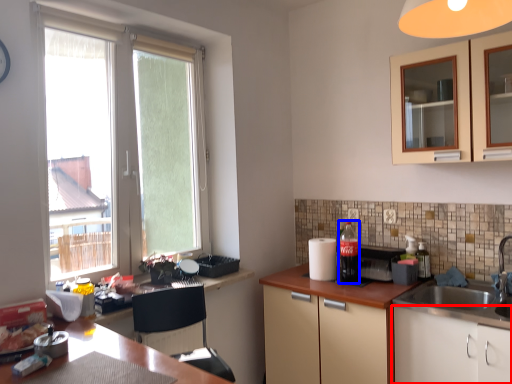
Question: Which point is further to the camera, cabinetry (highlighted by a red box) or beverage (highlighted by a blue box)?

Choices:
 (A) cabinetry
 (B) beverage

Answer: (B)